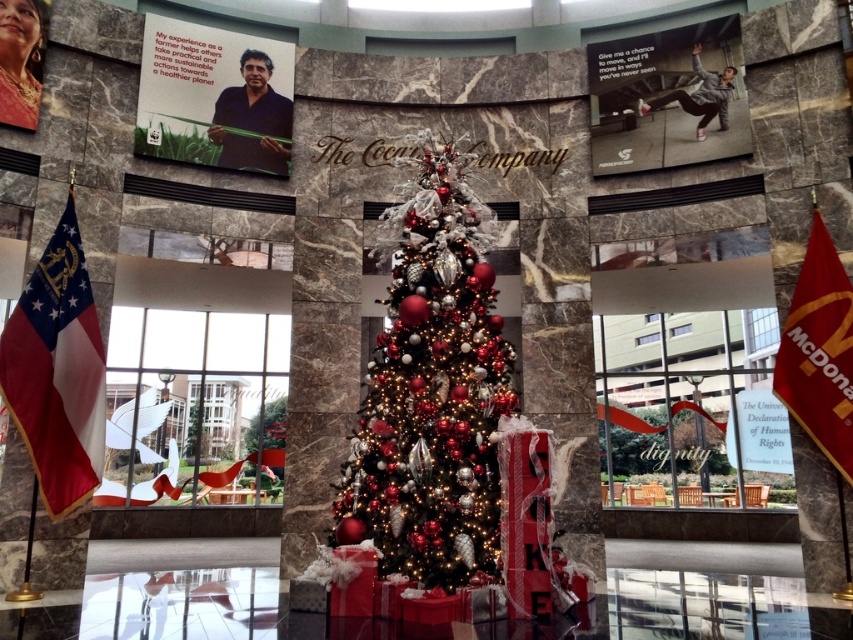
Based on the photo, you are planning to place a new decorative banner between the shiny metallic christmas tree at center and the red fabric flag at right. Given their widths, which side of the banner should be closer to the wider object to ensure proper alignment?

The shiny metallic christmas tree at center is wider than the red fabric flag at right. To ensure proper alignment, the banner should be placed closer to the shiny metallic christmas tree at center since it has a larger width.